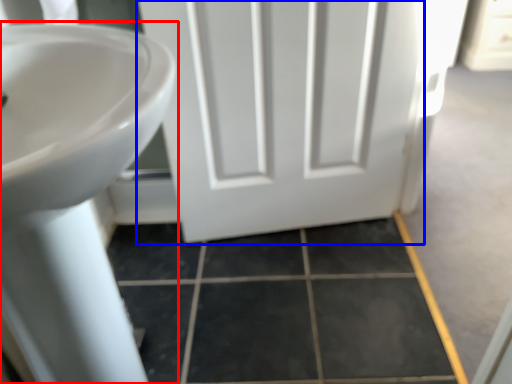
Question: Which point is further to the camera, sink (highlighted by a red box) or door (highlighted by a blue box)?

Choices:
 (A) sink
 (B) door

Answer: (B)